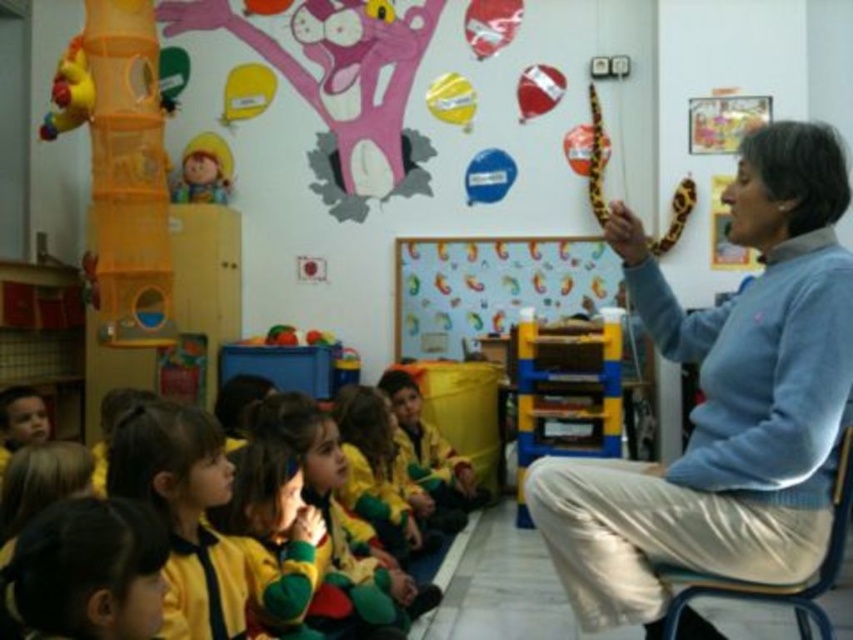
Question: Which is farther from the yellow-green uniform at lower left?

Choices:
 (A) yellow-green jersey at lower left
 (B) matte blue sweater at upper right

Answer: (B)

Question: Can you confirm if matte blue sweater at upper right is wider than metallic blue chair at center?

Choices:
 (A) no
 (B) yes

Answer: (B)

Question: Considering the real-world distances, which object is closest to the matte blue sweater at upper right?

Choices:
 (A) yellow-green uniform at lower left
 (B) matte yellow plush toy at upper left

Answer: (A)

Question: Which of the following is the closest to the observer?

Choices:
 (A) orange fabric tunnel at left
 (B) matte blue sweater at upper right
 (C) white paperboard at center

Answer: (B)

Question: Is yellow fabric uniform at lower left to the left of metallic blue chair at center from the viewer's perspective?

Choices:
 (A) no
 (B) yes

Answer: (B)

Question: Does yellow fabric uniform at lower left lie in front of yellow-green uniform at lower left?

Choices:
 (A) yes
 (B) no

Answer: (B)